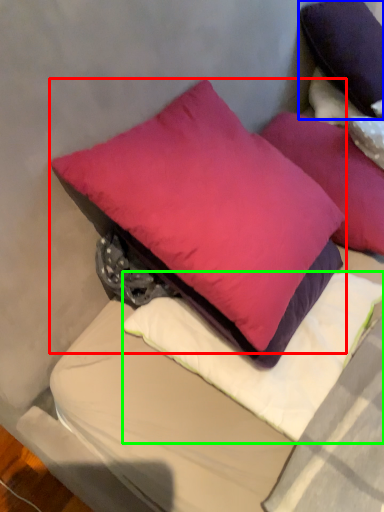
Question: Which object is the closest to the pillow (highlighted by a red box)? Choose among these: pillow (highlighted by a blue box) or pillow (highlighted by a green box).

Choices:
 (A) pillow
 (B) pillow

Answer: (B)